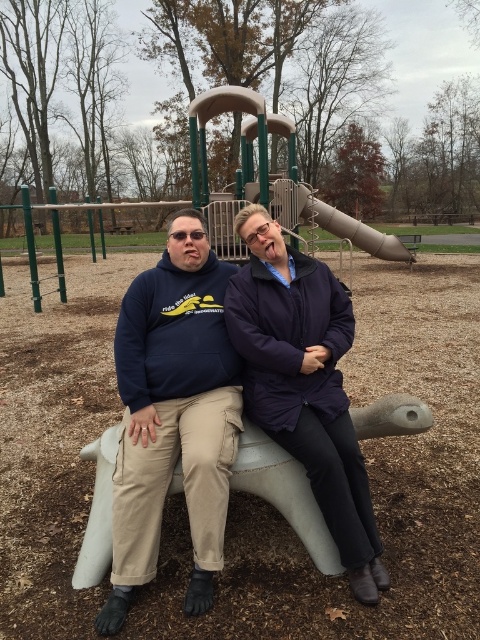
You are a photographer trying to capture both the matte blue hoodie at center and the navy blue hoodie at center in a single shot. Which hoodie will appear larger in the photo?

The matte blue hoodie at center will appear larger in the photo because it is closer to the viewer than the navy blue hoodie at center.

You are standing in front of the turtle playground structure and want to place a sticker on the point that is closer to you. Which point should you choose between point (116,621) and point (200,563)?

Point (116,621) is closer to the camera than point (200,563), so you should choose point (116,621).